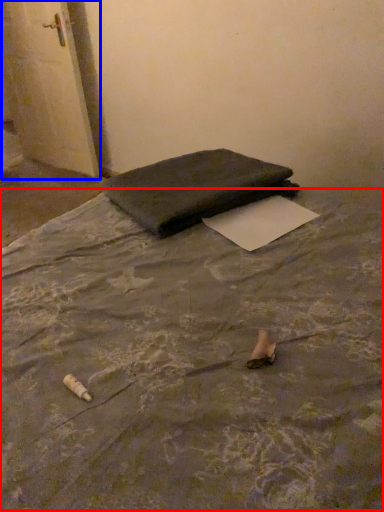
Question: Which point is closer to the camera, mattress (highlighted by a red box) or door (highlighted by a blue box)?

Choices:
 (A) mattress
 (B) door

Answer: (A)